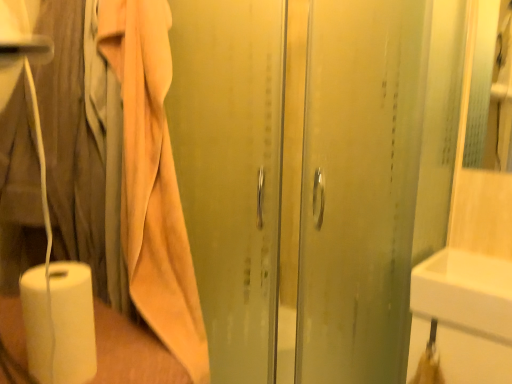
Question: From the image's perspective, is white matte paper towel at lower left located beneath white glossy sink at lower right?

Choices:
 (A) no
 (B) yes

Answer: (A)

Question: Would you say white glossy sink at lower right is part of white matte paper towel at lower left's contents?

Choices:
 (A) no
 (B) yes

Answer: (A)

Question: Is white matte paper towel at lower left at the right side of white glossy sink at lower right?

Choices:
 (A) no
 (B) yes

Answer: (A)

Question: Is white matte paper towel at lower left not inside white glossy sink at lower right?

Choices:
 (A) yes
 (B) no

Answer: (A)

Question: Considering the relative sizes of white matte paper towel at lower left and white glossy sink at lower right in the image provided, is white matte paper towel at lower left shorter than white glossy sink at lower right?

Choices:
 (A) no
 (B) yes

Answer: (A)

Question: Considering the positions of white glossy sink at lower right and transparent glass shower door at center in the image, is white glossy sink at lower right bigger or smaller than transparent glass shower door at center?

Choices:
 (A) big
 (B) small

Answer: (B)

Question: Relative to transparent glass shower door at center, is white glossy sink at lower right in front or behind?

Choices:
 (A) behind
 (B) front

Answer: (A)

Question: Considering the positions of white glossy sink at lower right and transparent glass shower door at center in the image, is white glossy sink at lower right taller or shorter than transparent glass shower door at center?

Choices:
 (A) tall
 (B) short

Answer: (B)

Question: From the image's perspective, is white glossy sink at lower right located above or below transparent glass shower door at center?

Choices:
 (A) above
 (B) below

Answer: (B)

Question: Considering their positions, is white glossy sink at lower right located in front of or behind white matte paper towel at lower left?

Choices:
 (A) front
 (B) behind

Answer: (B)

Question: Based on their sizes in the image, would you say white glossy sink at lower right is bigger or smaller than white matte paper towel at lower left?

Choices:
 (A) small
 (B) big

Answer: (B)

Question: Looking at their shapes, would you say white glossy sink at lower right is wider or thinner than white matte paper towel at lower left?

Choices:
 (A) thin
 (B) wide

Answer: (B)

Question: Is white glossy sink at lower right situated inside white matte paper towel at lower left or outside?

Choices:
 (A) inside
 (B) outside

Answer: (B)

Question: From their relative heights in the image, would you say beige cotton bath towel at left is taller or shorter than white glossy sink at lower right?

Choices:
 (A) short
 (B) tall

Answer: (B)

Question: Is beige cotton bath towel at left wider or thinner than white glossy sink at lower right?

Choices:
 (A) thin
 (B) wide

Answer: (B)